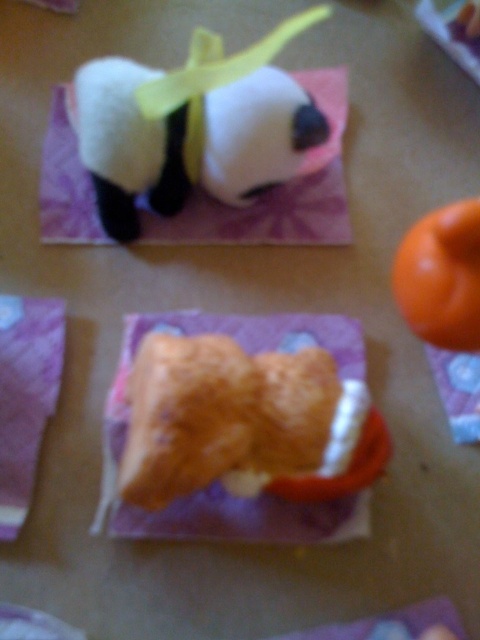
You are organizing items on a table and need to place a new item between the white plush panda at upper left and the orange matte ball at upper right. Based on their positions, where should you place the new item to ensure it is between them?

The white plush panda at upper left is to the left of the orange matte ball at upper right, so you should place the new item to the right of the white plush panda at upper left and to the left of the orange matte ball at upper right to position it between them.

You are organizing items on a table and need to place a new item between the white plush panda at upper left and the orange matte ball at upper right. Based on their positions, where should you place the new item?

The white plush panda at upper left is located above the orange matte ball at upper right, so you should place the new item between them either below the white plush panda at upper left and above the orange matte ball at upper right.